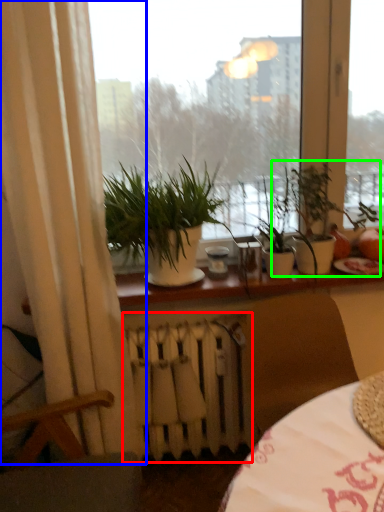
Question: Estimate the real-world distances between objects in this image. Which object is closer to radiator (highlighted by a red box), curtain (highlighted by a blue box) or houseplant (highlighted by a green box)?

Choices:
 (A) curtain
 (B) houseplant

Answer: (A)